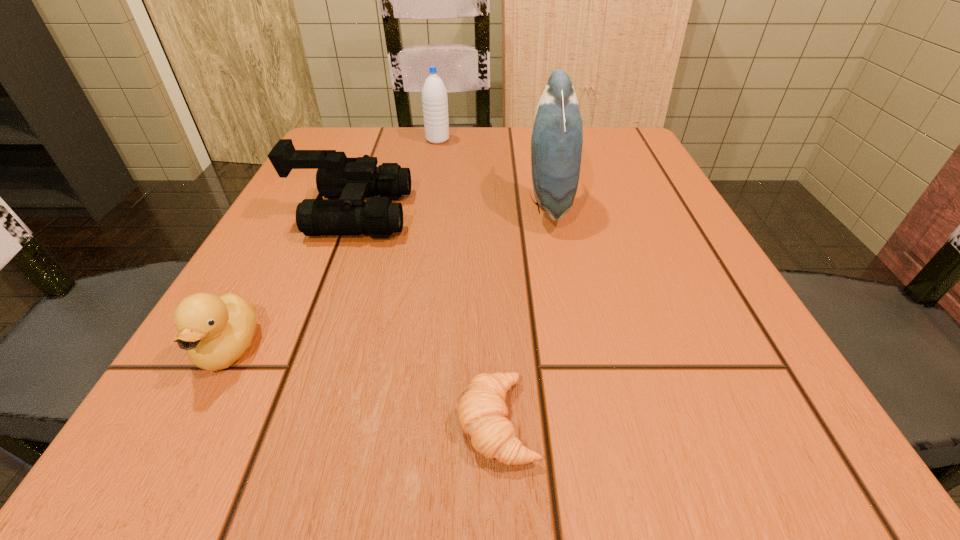
Where is `free space between the crescent roll and the binoculars`? free space between the crescent roll and the binoculars is located at coordinates (424, 318).

This screenshot has width=960, height=540. What are the coordinates of `vacant space that's between the binoculars and the shortest object` in the screenshot? It's located at (424, 318).

I want to click on vacant space in between the duckling and the binoculars, so click(290, 281).

At what (x,y) coordinates should I click in order to perform the action: click on free space between the rightmost object and the binoculars. Please return your answer as a coordinate pair (x, y). The image size is (960, 540). Looking at the image, I should click on (449, 208).

What are the coordinates of `object that ranks as the second closest to the crescent roll` in the screenshot? It's located at (351, 180).

At what (x,y) coordinates should I click in order to perform the action: click on object that is the third nearest to the bird. Please return your answer as a coordinate pair (x, y). The height and width of the screenshot is (540, 960). Looking at the image, I should click on (482, 412).

Identify the location of free spot that satisfies the following two spatial constraints: 1. at the tip of the bird's beak; 2. on the face of the duckling. This screenshot has width=960, height=540. (578, 348).

Where is `vacant space that satisfies the following two spatial constraints: 1. on the front lenses of the third tallest object; 2. on the face of the second shortest object`? The width and height of the screenshot is (960, 540). vacant space that satisfies the following two spatial constraints: 1. on the front lenses of the third tallest object; 2. on the face of the second shortest object is located at coordinates (299, 348).

Locate an element on the screen. This screenshot has height=540, width=960. vacant position in the image that satisfies the following two spatial constraints: 1. at the tip of the rightmost object's beak; 2. on the front side of the fourth object from left to right is located at coordinates (593, 422).

The image size is (960, 540). I want to click on vacant space that satisfies the following two spatial constraints: 1. on the front lenses of the binoculars; 2. on the face of the fourth tallest object, so click(299, 348).